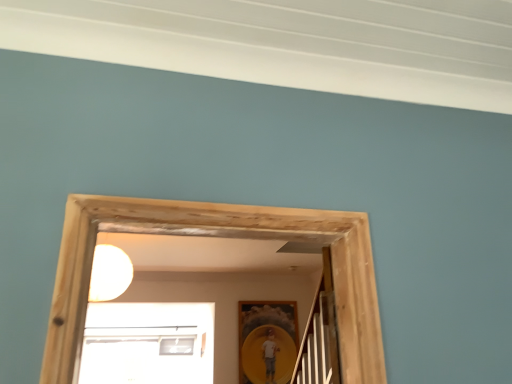
The width and height of the screenshot is (512, 384). Describe the element at coordinates (266, 338) in the screenshot. I see `matte yellow picture frame at center` at that location.

Where is `matte yellow picture frame at center`? matte yellow picture frame at center is located at coordinates (266, 338).

This screenshot has width=512, height=384. What do you see at coordinates (109, 273) in the screenshot?
I see `white matte light bulb at upper center` at bounding box center [109, 273].

At what (x,y) coordinates should I click in order to perform the action: click on white matte light bulb at upper center. Please return your answer as a coordinate pair (x, y). Looking at the image, I should click on (109, 273).

At what (x,y) coordinates should I click in order to perform the action: click on matte yellow picture frame at center. Please return your answer as a coordinate pair (x, y). Looking at the image, I should click on coord(266,338).

Which object is positioned more to the left, white matte light bulb at upper center or matte yellow picture frame at center?

white matte light bulb at upper center.

Which is behind, white matte light bulb at upper center or matte yellow picture frame at center?

matte yellow picture frame at center.

Is point (98, 251) closer or farther from the camera than point (296, 333)?

Point (98, 251) is positioned closer to the camera compared to point (296, 333).

From the image's perspective, is white matte light bulb at upper center under matte yellow picture frame at center?

Incorrect, from the image's perspective, white matte light bulb at upper center is higher than matte yellow picture frame at center.

From a real-world perspective, does white matte light bulb at upper center sit lower than matte yellow picture frame at center?

No, from a real-world perspective, white matte light bulb at upper center is not below matte yellow picture frame at center.

Can you confirm if white matte light bulb at upper center is thinner than matte yellow picture frame at center?

No.

Can you confirm if white matte light bulb at upper center is shorter than matte yellow picture frame at center?

Yes.

Consider the image. Considering the sizes of objects white matte light bulb at upper center and matte yellow picture frame at center in the image provided, who is bigger, white matte light bulb at upper center or matte yellow picture frame at center?

white matte light bulb at upper center.

Is white matte light bulb at upper center positioned beyond the bounds of matte yellow picture frame at center?

Yes, white matte light bulb at upper center is outside of matte yellow picture frame at center.

Is white matte light bulb at upper center next to matte yellow picture frame at center?

There is a gap between white matte light bulb at upper center and matte yellow picture frame at center.

From the picture: Could you tell me if white matte light bulb at upper center is facing matte yellow picture frame at center?

No, white matte light bulb at upper center does not turn towards matte yellow picture frame at center.

Locate an element on the screen. The image size is (512, 384). picture frame beneath the white matte light bulb at upper center (from a real-world perspective) is located at coordinates (266, 338).

Does matte yellow picture frame at center appear on the right side of white matte light bulb at upper center?

Yes.

Consider the image. Considering the relative positions of matte yellow picture frame at center and white matte light bulb at upper center in the image provided, is matte yellow picture frame at center in front of white matte light bulb at upper center?

No, matte yellow picture frame at center is further to the viewer.

Between point (281, 373) and point (104, 275), which one is positioned behind?

The point (281, 373) is more distant.

From the image's perspective, would you say matte yellow picture frame at center is positioned over white matte light bulb at upper center?

No, from the image's perspective, matte yellow picture frame at center is not above white matte light bulb at upper center.

From a real-world perspective, who is located higher, matte yellow picture frame at center or white matte light bulb at upper center?

In real-world perspective, white matte light bulb at upper center is above.

In terms of width, does matte yellow picture frame at center look wider or thinner when compared to white matte light bulb at upper center?

matte yellow picture frame at center is thinner than white matte light bulb at upper center.

From their relative heights in the image, would you say matte yellow picture frame at center is taller or shorter than white matte light bulb at upper center?

matte yellow picture frame at center is taller than white matte light bulb at upper center.

Considering the sizes of matte yellow picture frame at center and white matte light bulb at upper center in the image, is matte yellow picture frame at center bigger or smaller than white matte light bulb at upper center?

In the image, matte yellow picture frame at center appears to be smaller than white matte light bulb at upper center.

Is matte yellow picture frame at center completely or partially outside of white matte light bulb at upper center?

Yes.

Consider the image. Is matte yellow picture frame at center far from white matte light bulb at upper center?

Yes, matte yellow picture frame at center and white matte light bulb at upper center are located far from each other.

Is matte yellow picture frame at center facing towards white matte light bulb at upper center?

No, matte yellow picture frame at center is not aimed at white matte light bulb at upper center.

How many degrees apart are the facing directions of matte yellow picture frame at center and white matte light bulb at upper center?

They differ by 3.05 degrees in their facing directions.

The width and height of the screenshot is (512, 384). What are the coordinates of `light on the left side of matte yellow picture frame at center` in the screenshot? It's located at (109, 273).

This screenshot has height=384, width=512. In order to click on light on the left of the matte yellow picture frame at center in this screenshot , I will do `click(109, 273)`.

Where is `picture frame that appears below the white matte light bulb at upper center (from a real-world perspective)`? picture frame that appears below the white matte light bulb at upper center (from a real-world perspective) is located at coordinates (266, 338).